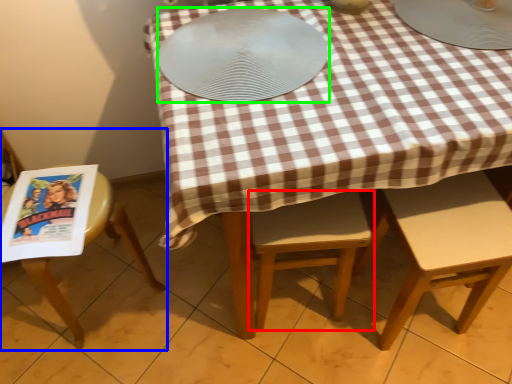
Question: Considering the real-world distances, which object is closest to chair (highlighted by a red box)? chair (highlighted by a blue box) or platter (highlighted by a green box).

Choices:
 (A) chair
 (B) platter

Answer: (B)